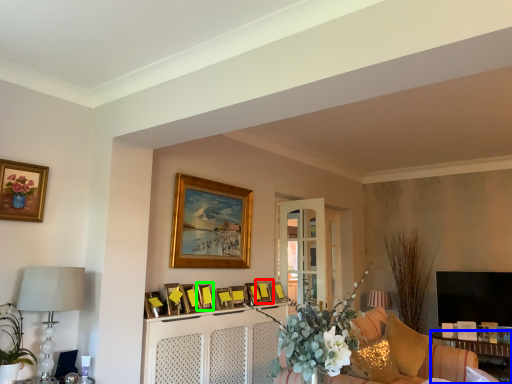
Question: Estimate the real-world distances between objects in this image. Which object is farther from picture frame (highlighted by a red box), table (highlighted by a blue box) or picture frame (highlighted by a green box)?

Choices:
 (A) table
 (B) picture frame

Answer: (A)